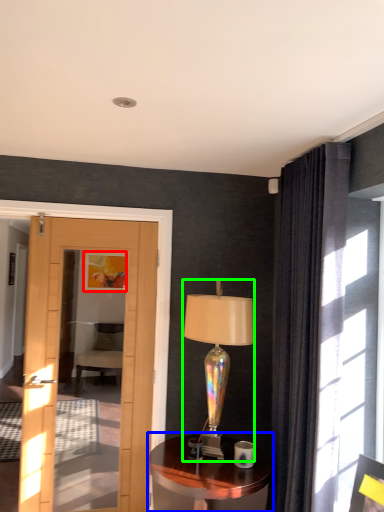
Question: Which object is positioned farthest from picture frame (highlighted by a red box)? Select from table (highlighted by a blue box) and lamp (highlighted by a green box).

Choices:
 (A) table
 (B) lamp

Answer: (A)